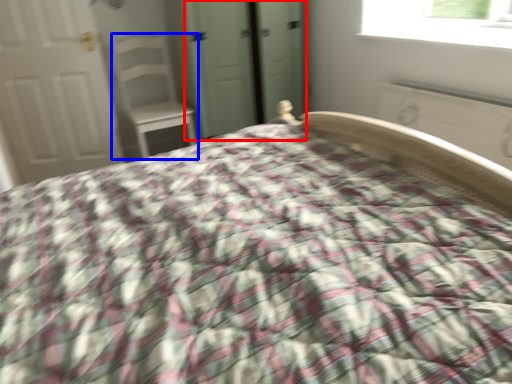
Question: Among these objects, which one is farthest to the camera, screen door (highlighted by a red box) or chair (highlighted by a blue box)?

Choices:
 (A) screen door
 (B) chair

Answer: (B)